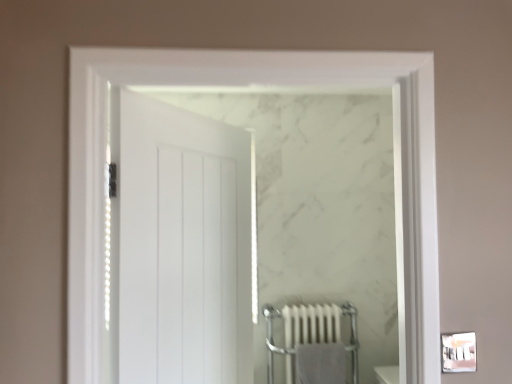
Measure the distance between point [331,376] and camera.

The depth of point [331,376] is 7.47 feet.

The height and width of the screenshot is (384, 512). I want to click on white metallic radiator at lower center, so click(x=311, y=324).

Considering the relative sizes of white matte door at center and gray cotton bath towel at lower center in the image provided, is white matte door at center thinner than gray cotton bath towel at lower center?

No, white matte door at center is not thinner than gray cotton bath towel at lower center.

Is white matte door at center smaller than gray cotton bath towel at lower center?

No.

Is white matte door at center oriented towards gray cotton bath towel at lower center?

No.

Is there a large distance between white matte door at center and gray cotton bath towel at lower center?

Indeed, white matte door at center is not near gray cotton bath towel at lower center.

Are white metallic radiator at lower center and gray cotton bath towel at lower center far apart?

white metallic radiator at lower center is near gray cotton bath towel at lower center, not far away.

Considering the relative positions of white metallic radiator at lower center and gray cotton bath towel at lower center in the image provided, is white metallic radiator at lower center to the left of gray cotton bath towel at lower center from the viewer's perspective?

Yes.

Find the location of `radiator on the left of gray cotton bath towel at lower center`. radiator on the left of gray cotton bath towel at lower center is located at coordinates (311, 324).

Is gray cotton bath towel at lower center a part of white metallic radiator at lower center?

Yes, gray cotton bath towel at lower center is surrounded by white metallic radiator at lower center.

From the image's perspective, relative to white metallic radiator at lower center, is white matte door at center above or below?

Based on their image positions, white matte door at center is located above white metallic radiator at lower center.

Does point (206, 146) appear closer or farther from the camera than point (324, 381)?

Clearly, point (206, 146) is closer to the camera than point (324, 381).

Looking at this image, who is more distant, white matte door at center or white metallic radiator at lower center?

white metallic radiator at lower center is further away from the camera.

Is white matte door at center taller than white metallic radiator at lower center?

Yes, white matte door at center is taller than white metallic radiator at lower center.

Is gray cotton bath towel at lower center with white metallic radiator at lower center?

Yes.

Looking at their sizes, would you say gray cotton bath towel at lower center is wider or thinner than white metallic radiator at lower center?

gray cotton bath towel at lower center is thinner than white metallic radiator at lower center.

From the image's perspective, which is above, gray cotton bath towel at lower center or white matte door at center?

white matte door at center.

There is a gray cotton bath towel at lower center. Where is `door above it (from a real-world perspective)`? The image size is (512, 384). door above it (from a real-world perspective) is located at coordinates (183, 246).

Considering the positions of objects gray cotton bath towel at lower center and white matte door at center in the image provided, who is in front, gray cotton bath towel at lower center or white matte door at center?

white matte door at center is in front.

From a real-world perspective, between gray cotton bath towel at lower center and white matte door at center, who is vertically lower?

gray cotton bath towel at lower center is physically lower.

Is white metallic radiator at lower center at the right side of white matte door at center?

Yes.

Is white metallic radiator at lower center bigger or smaller than white matte door at center?

In the image, white metallic radiator at lower center appears to be smaller than white matte door at center.

Does white metallic radiator at lower center lie in front of white matte door at center?

No, the depth of white metallic radiator at lower center is greater than that of white matte door at center.

Is white metallic radiator at lower center taller than white matte door at center?

No.

This screenshot has width=512, height=384. I want to click on bath towel lying behind the white matte door at center, so click(321, 363).

This screenshot has width=512, height=384. What are the coordinates of `bath towel lying on the right of white metallic radiator at lower center` in the screenshot? It's located at (321, 363).

Which object lies nearer to the anchor point white metallic radiator at lower center, gray cotton bath towel at lower center or white matte door at center?

Among the two, gray cotton bath towel at lower center is located nearer to white metallic radiator at lower center.

When comparing their distances from gray cotton bath towel at lower center, does white matte door at center or white metallic radiator at lower center seem further?

The object further to gray cotton bath towel at lower center is white matte door at center.

Estimate the real-world distances between objects in this image. Which object is closer to white matte door at center, white metallic radiator at lower center or gray cotton bath towel at lower center?

white metallic radiator at lower center is positioned closer to the anchor white matte door at center.

Which object lies further to the anchor point white matte door at center, gray cotton bath towel at lower center or white metallic radiator at lower center?

Among the two, gray cotton bath towel at lower center is located further to white matte door at center.

Estimate the real-world distances between objects in this image. Which object is closer to white metallic radiator at lower center, white matte door at center or gray cotton bath towel at lower center?

gray cotton bath towel at lower center is closer to white metallic radiator at lower center.

Estimate the real-world distances between objects in this image. Which object is closer to gray cotton bath towel at lower center, white metallic radiator at lower center or white matte door at center?

white metallic radiator at lower center lies closer to gray cotton bath towel at lower center than the other object.

You are a GUI agent. You are given a task and a screenshot of the screen. Output one action in this format:
    pyautogui.click(x=<x>, y=<y>)
    Task: Click on the bath towel positioned between white matte door at center and white metallic radiator at lower center from near to far
    This screenshot has width=512, height=384.
    Given the screenshot: What is the action you would take?
    [321, 363]